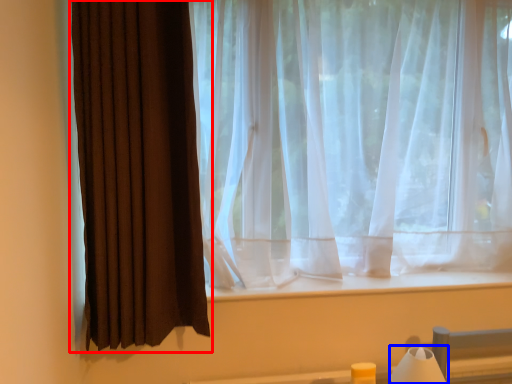
Question: Among these objects, which one is nearest to the camera, curtain (highlighted by a red box) or table lamp (highlighted by a blue box)?

Choices:
 (A) curtain
 (B) table lamp

Answer: (A)